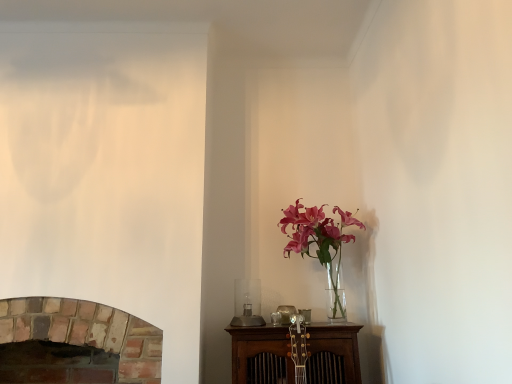
What do you see at coordinates (319, 240) in the screenshot? I see `translucent glass vase at upper right` at bounding box center [319, 240].

Locate an element on the screen. This screenshot has width=512, height=384. translucent glass vase at upper right is located at coordinates (319, 240).

Where is `brick fireplace at lower left`? This screenshot has height=384, width=512. brick fireplace at lower left is located at coordinates 87,332.

What do you see at coordinates (87, 332) in the screenshot?
I see `brick fireplace at lower left` at bounding box center [87, 332].

Find the location of a particular element. Image resolution: width=512 pixels, height=384 pixels. translucent glass vase at upper right is located at coordinates 319,240.

Is brick fireplace at lower left to the left or to the right of translucent glass vase at upper right in the image?

brick fireplace at lower left is to the left of translucent glass vase at upper right.

Which object is closer to the camera, brick fireplace at lower left or translucent glass vase at upper right?

brick fireplace at lower left is closer to the camera.

Considering the positions of points (87, 339) and (311, 207), is point (87, 339) closer to camera compared to point (311, 207)?

That is True.

From the image's perspective, does brick fireplace at lower left appear lower than translucent glass vase at upper right?

Yes.

From a real-world perspective, between brick fireplace at lower left and translucent glass vase at upper right, who is vertically higher?

translucent glass vase at upper right, from a real-world perspective.

Is brick fireplace at lower left thinner than translucent glass vase at upper right?

Incorrect, the width of brick fireplace at lower left is not less than that of translucent glass vase at upper right.

Which of these two, brick fireplace at lower left or translucent glass vase at upper right, stands shorter?

brick fireplace at lower left is shorter.

Considering the relative sizes of brick fireplace at lower left and translucent glass vase at upper right in the image provided, is brick fireplace at lower left bigger than translucent glass vase at upper right?

Indeed, brick fireplace at lower left has a larger size compared to translucent glass vase at upper right.

Is brick fireplace at lower left not inside translucent glass vase at upper right?

Yes, brick fireplace at lower left is not within translucent glass vase at upper right.

Is brick fireplace at lower left far away from translucent glass vase at upper right?

No, there isn't a large distance between brick fireplace at lower left and translucent glass vase at upper right.

Is brick fireplace at lower left facing away from translucent glass vase at upper right?

No, brick fireplace at lower left's orientation is not away from translucent glass vase at upper right.

Locate an element on the screen. The width and height of the screenshot is (512, 384). fireplace below the translucent glass vase at upper right (from the image's perspective) is located at coordinates (87, 332).

Is translucent glass vase at upper right to the left of brick fireplace at lower left from the viewer's perspective?

Incorrect, translucent glass vase at upper right is not on the left side of brick fireplace at lower left.

Which object is closer to the camera, translucent glass vase at upper right or brick fireplace at lower left?

brick fireplace at lower left is closer to the camera.

Between point (285, 230) and point (101, 333), which one is positioned in front?

Point (101, 333)

From the image's perspective, is translucent glass vase at upper right beneath brick fireplace at lower left?

Actually, translucent glass vase at upper right appears above brick fireplace at lower left in the image.

From a real-world perspective, which object rests below the other?

From a 3D spatial view, brick fireplace at lower left is below.

Considering the sizes of objects translucent glass vase at upper right and brick fireplace at lower left in the image provided, who is wider, translucent glass vase at upper right or brick fireplace at lower left?

brick fireplace at lower left.

Considering the sizes of translucent glass vase at upper right and brick fireplace at lower left in the image, is translucent glass vase at upper right taller or shorter than brick fireplace at lower left?

In the image, translucent glass vase at upper right appears to be taller than brick fireplace at lower left.

Considering the relative sizes of translucent glass vase at upper right and brick fireplace at lower left in the image provided, is translucent glass vase at upper right bigger than brick fireplace at lower left?

No, translucent glass vase at upper right is not bigger than brick fireplace at lower left.

Is translucent glass vase at upper right positioned beyond the bounds of brick fireplace at lower left?

Yes, translucent glass vase at upper right is not within brick fireplace at lower left.

Is translucent glass vase at upper right not near brick fireplace at lower left?

That's not correct — translucent glass vase at upper right is a little close to brick fireplace at lower left.

Is brick fireplace at lower left at the back of translucent glass vase at upper right?

That's not correct — translucent glass vase at upper right is not looking away from brick fireplace at lower left.

Consider the image. How different are the orientations of translucent glass vase at upper right and brick fireplace at lower left in degrees?

The facing directions of translucent glass vase at upper right and brick fireplace at lower left are 0.0975 degrees apart.

Where is `houseplant lying behind the brick fireplace at lower left`? The image size is (512, 384). houseplant lying behind the brick fireplace at lower left is located at coordinates (319, 240).

This screenshot has width=512, height=384. I want to click on houseplant lying above the brick fireplace at lower left (from the image's perspective), so click(319, 240).

You are a GUI agent. You are given a task and a screenshot of the screen. Output one action in this format:
    pyautogui.click(x=<x>, y=<y>)
    Task: Click on the fireplace that is on the left side of translucent glass vase at upper right
    The image size is (512, 384).
    Given the screenshot: What is the action you would take?
    pyautogui.click(x=87, y=332)